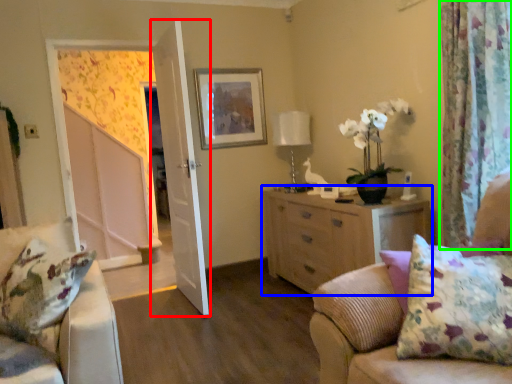
Question: Based on their relative distances, which object is farther from door (highlighted by a red box)? Choose from cabinetry (highlighted by a blue box) and curtain (highlighted by a green box).

Choices:
 (A) cabinetry
 (B) curtain

Answer: (B)